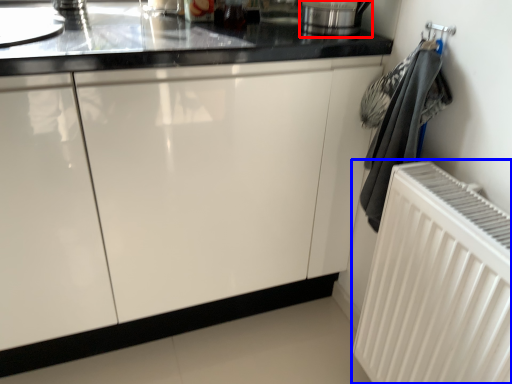
Question: Which of the following is the farthest to the observer, appliance (highlighted by a red box) or radiator (highlighted by a blue box)?

Choices:
 (A) appliance
 (B) radiator

Answer: (A)